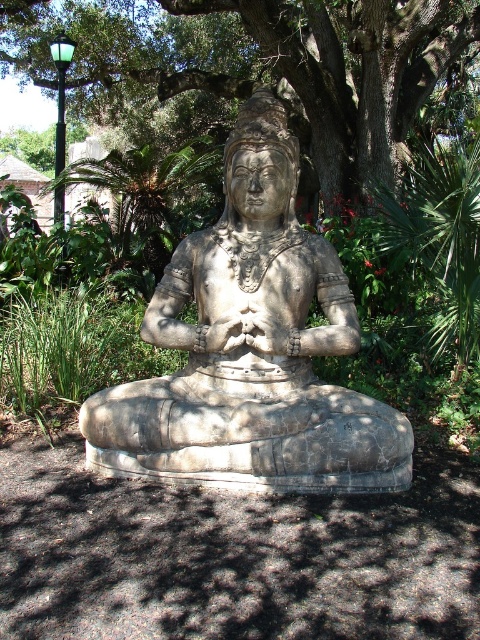
Is gray stone statue at center to the left of green leafy tree at center from the viewer's perspective?

Yes, gray stone statue at center is to the left of green leafy tree at center.

Does gray stone statue at center lie in front of green leafy tree at center?

Yes, gray stone statue at center is closer to the viewer.

Is point (291, 195) positioned behind point (476, 10)?

No, (291, 195) is in front of (476, 10).

I want to click on gray stone statue at center, so click(x=251, y=349).